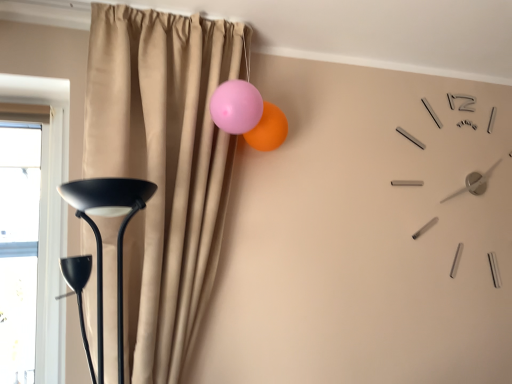
Identify the location of pink glossy balloon at upper center. The width and height of the screenshot is (512, 384). (268, 129).

Image resolution: width=512 pixels, height=384 pixels. What do you see at coordinates (163, 167) in the screenshot? I see `beige curtain at upper center` at bounding box center [163, 167].

Where is `pink glossy balloon at upper center`? Image resolution: width=512 pixels, height=384 pixels. pink glossy balloon at upper center is located at coordinates point(268,129).

Can you see pink glossy balloon at upper center touching transparent glass window at left?

pink glossy balloon at upper center is not next to transparent glass window at left, and they're not touching.

Between pink glossy balloon at upper center and transparent glass window at left, which one has larger width?

With larger width is pink glossy balloon at upper center.

Is transparent glass window at left inside pink glossy balloon at upper center?

No, transparent glass window at left is located outside of pink glossy balloon at upper center.

Looking at this image, who is taller, pink glossy balloon at upper center or transparent glass window at left?

transparent glass window at left is taller.

Is beige curtain at upper center beside transparent glass window at left?

No, beige curtain at upper center is not touching transparent glass window at left.

Is beige curtain at upper center positioned with its back to transparent glass window at left?

No, transparent glass window at left is not at the back of beige curtain at upper center.

Considering the positions of objects beige curtain at upper center and transparent glass window at left in the image provided, who is more to the left, beige curtain at upper center or transparent glass window at left?

From the viewer's perspective, transparent glass window at left appears more on the left side.

Considering the sizes of objects beige curtain at upper center and transparent glass window at left in the image provided, who is shorter, beige curtain at upper center or transparent glass window at left?

With less height is transparent glass window at left.

In order to click on window located on the left of pink glossy balloon at upper center in this screenshot , I will do `click(18, 248)`.

Is transparent glass window at left turned away from pink glossy balloon at upper center?

No, pink glossy balloon at upper center is not at the back of transparent glass window at left.

From the picture: Considering the relative sizes of transparent glass window at left and pink glossy balloon at upper center in the image provided, is transparent glass window at left bigger than pink glossy balloon at upper center?

Correct, transparent glass window at left is larger in size than pink glossy balloon at upper center.

Would you say transparent glass window at left is a long distance from pink glossy balloon at upper center?

transparent glass window at left is near pink glossy balloon at upper center, not far away.

There is a transparent glass window at left. In order to click on curtain above it (from a real-world perspective) in this screenshot , I will do `click(163, 167)`.

From a real-world perspective, between transparent glass window at left and beige curtain at upper center, who is vertically higher?

beige curtain at upper center is physically above.

Is transparent glass window at left taller than beige curtain at upper center?

Incorrect, the height of transparent glass window at left is not larger of that of beige curtain at upper center.

Can you confirm if pink glossy balloon at upper center is thinner than beige curtain at upper center?

Yes.

Is pink glossy balloon at upper center inside or outside of beige curtain at upper center?

pink glossy balloon at upper center exists entirely within beige curtain at upper center.

Can you confirm if pink glossy balloon at upper center is taller than beige curtain at upper center?

No, pink glossy balloon at upper center is not taller than beige curtain at upper center.

You are a GUI agent. You are given a task and a screenshot of the screen. Output one action in this format:
    pyautogui.click(x=<x>, y=<y>)
    Task: Click on the balloon that appears behind the beige curtain at upper center
    The height and width of the screenshot is (384, 512).
    Given the screenshot: What is the action you would take?
    pyautogui.click(x=268, y=129)

Is beige curtain at upper center next to pink glossy balloon at upper center and touching it?

No.

Could you tell me if beige curtain at upper center is turned towards pink glossy balloon at upper center?

No, beige curtain at upper center is not aimed at pink glossy balloon at upper center.

Does point (167, 72) lie behind point (286, 124)?

No, it is not.

From the image's perspective, relative to pink glossy balloon at upper center, is beige curtain at upper center above or below?

From the image's perspective, beige curtain at upper center appears below pink glossy balloon at upper center.

Find the location of a particular element. window below the pink glossy balloon at upper center (from a real-world perspective) is located at coordinates (18, 248).

Where is `curtain located above the transparent glass window at left (from a real-world perspective)`? curtain located above the transparent glass window at left (from a real-world perspective) is located at coordinates (163, 167).

Considering their positions, is pink glossy balloon at upper center positioned further to transparent glass window at left than beige curtain at upper center?

The object further to transparent glass window at left is pink glossy balloon at upper center.

When comparing their distances from beige curtain at upper center, does pink glossy balloon at upper center or transparent glass window at left seem closer?

pink glossy balloon at upper center is closer to beige curtain at upper center.

Estimate the real-world distances between objects in this image. Which object is further from beige curtain at upper center, transparent glass window at left or pink glossy balloon at upper center?

transparent glass window at left is positioned further to the anchor beige curtain at upper center.

Looking at the image, which one is located closer to pink glossy balloon at upper center, transparent glass window at left or beige curtain at upper center?

beige curtain at upper center.

When comparing their distances from transparent glass window at left, does beige curtain at upper center or pink glossy balloon at upper center seem further?

pink glossy balloon at upper center.

When comparing their distances from pink glossy balloon at upper center, does beige curtain at upper center or transparent glass window at left seem further?

Based on the image, transparent glass window at left appears to be further to pink glossy balloon at upper center.

Find the location of a particular element. The width and height of the screenshot is (512, 384). curtain between transparent glass window at left and pink glossy balloon at upper center from left to right is located at coordinates (163, 167).